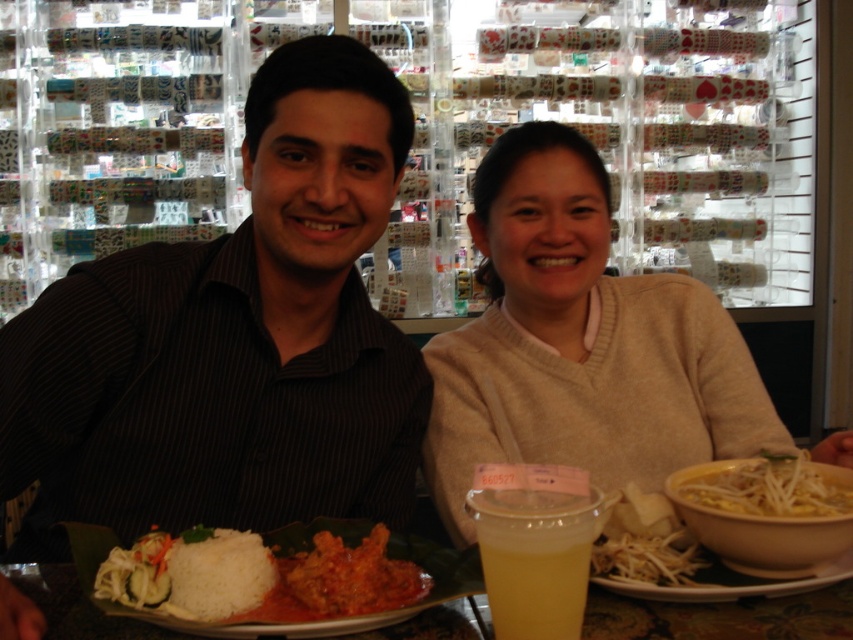
Question: Is beige sweater at center positioned behind white matte rice at center?

Choices:
 (A) yes
 (B) no

Answer: (A)

Question: Is translucent plastic cup at center wider than yellow matte bowl at lower right?

Choices:
 (A) no
 (B) yes

Answer: (A)

Question: Is white matte rice at center to the left of translucent plastic cup at center from the viewer's perspective?

Choices:
 (A) no
 (B) yes

Answer: (B)

Question: Which of the following is the farthest from the observer?

Choices:
 (A) (515, 531)
 (B) (711, 500)
 (C) (666, 512)

Answer: (C)

Question: Which object is positioned closest to the black striped shirt at center?

Choices:
 (A) white matte rice at center
 (B) translucent plastic cup at center
 (C) yellow translucent noodles at lower center

Answer: (A)

Question: Which point is closer to the camera?

Choices:
 (A) translucent plastic cup at center
 (B) yellow translucent noodles at lower center
 (C) tomato sauce coated chicken at center
 (D) beige sweater at center

Answer: (A)